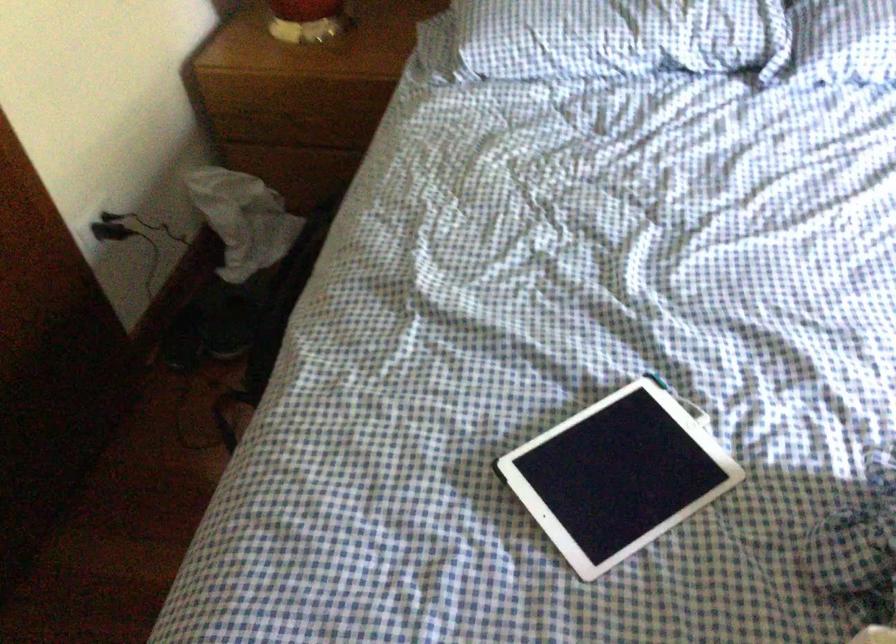
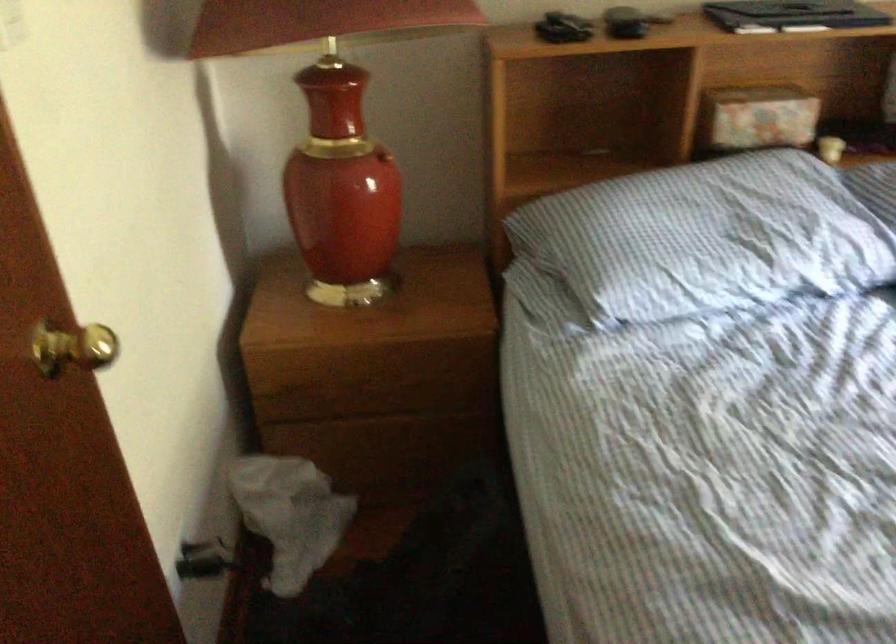
Which direction would the cameraman need to move to produce the second image?

The cameraman walked toward left, forward.